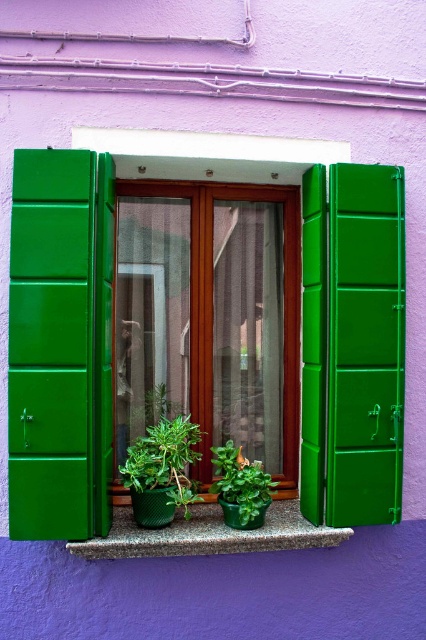
Question: Can you confirm if granite at center is smaller than green matte plant at center?

Choices:
 (A) no
 (B) yes

Answer: (A)

Question: Among these points, which one is farthest from the camera?

Choices:
 (A) (77, 336)
 (B) (143, 253)
 (C) (241, 496)
 (D) (132, 499)

Answer: (B)

Question: Observing the image, what is the correct spatial positioning of wooden frame at center in reference to granite at center?

Choices:
 (A) right
 (B) left

Answer: (B)

Question: Estimate the real-world distances between objects in this image. Which object is farther from the green matte plant at center?

Choices:
 (A) green plastic window box at center
 (B) green matte pot at center
 (C) granite at center

Answer: (A)

Question: Estimate the real-world distances between objects in this image. Which object is closer to the green plastic window box at center?

Choices:
 (A) granite at center
 (B) green matte plant at center
 (C) green matte pot at center
 (D) wooden frame at center

Answer: (D)

Question: From the image, what is the correct spatial relationship of green plastic window box at center in relation to green matte pot at center?

Choices:
 (A) below
 (B) above

Answer: (B)